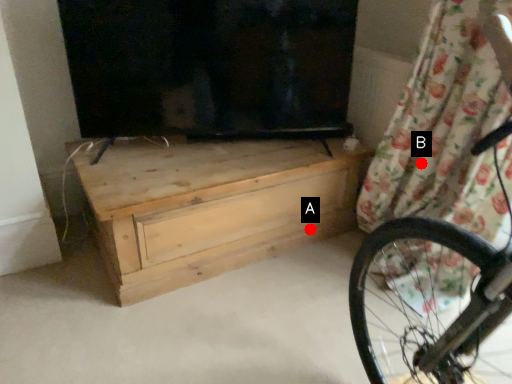
Question: Two points are circled on the image, labeled by A and B beside each circle. Which point is farther to the camera?

Choices:
 (A) A is further
 (B) B is further

Answer: (A)